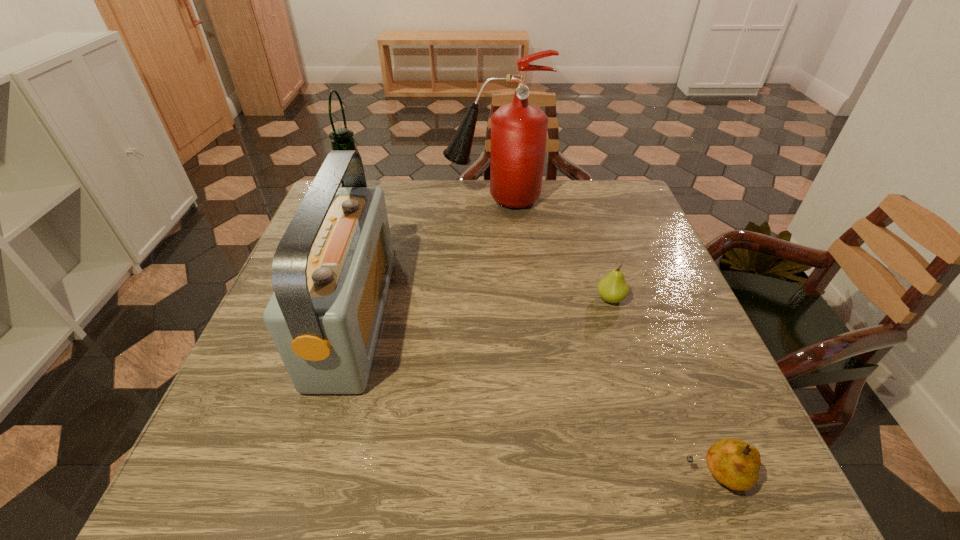
The image size is (960, 540). Identify the location of vacant space located 0.080m on the front-facing side of the radio receiver. (420, 319).

Where is `free space located on the left of the farther pear`? This screenshot has width=960, height=540. free space located on the left of the farther pear is located at coordinates (509, 299).

Where is `vacant space located 0.060m on the left of the nearest object`? The height and width of the screenshot is (540, 960). vacant space located 0.060m on the left of the nearest object is located at coordinates (645, 475).

The width and height of the screenshot is (960, 540). Find the location of `fire extinguisher located in the far edge section of the desktop`. fire extinguisher located in the far edge section of the desktop is located at coordinates (519, 129).

This screenshot has width=960, height=540. I want to click on lantern that is at the far edge, so click(341, 138).

What are the coordinates of `object at the near edge` in the screenshot? It's located at (734, 463).

Locate an element on the screen. Image resolution: width=960 pixels, height=540 pixels. lantern at the left edge is located at coordinates pos(341,138).

Locate an element on the screen. The width and height of the screenshot is (960, 540). radio receiver at the left edge is located at coordinates (331, 271).

You are a GUI agent. You are given a task and a screenshot of the screen. Output one action in this format:
    pyautogui.click(x=<x>, y=<y>)
    Task: Click on the object located in the far left corner section of the desktop
    The width and height of the screenshot is (960, 540).
    Given the screenshot: What is the action you would take?
    pyautogui.click(x=341, y=138)

Find the location of a particular element. This screenshot has width=960, height=540. object present at the near right corner is located at coordinates (734, 463).